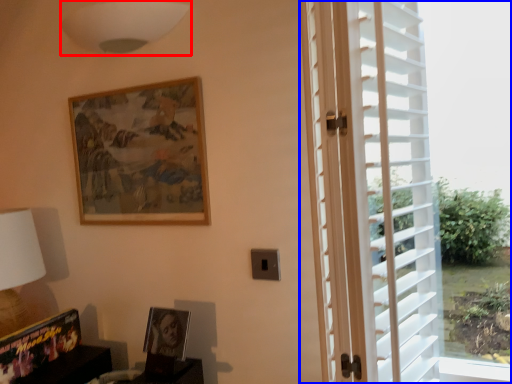
Question: Which of the following is the closest to the observer, lamp (highlighted by a red box) or window (highlighted by a blue box)?

Choices:
 (A) lamp
 (B) window

Answer: (B)